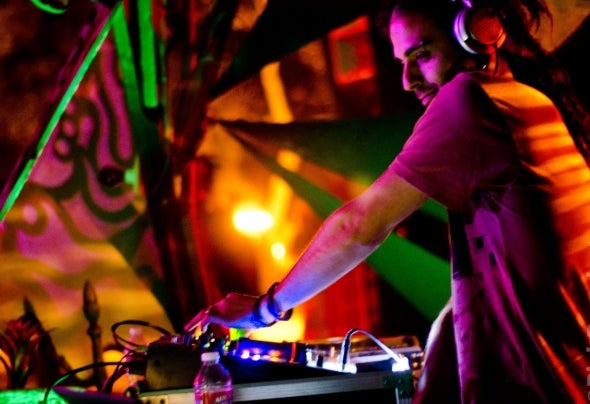
You are a GUI agent. You are given a task and a screenshot of the screen. Output one action in this format:
    pyautogui.click(x=<x>, y=<y>)
    Task: Click on the light
    Image resolution: width=590 pixels, height=404 pixels.
    Given the screenshot: What is the action you would take?
    pyautogui.click(x=252, y=216), pyautogui.click(x=278, y=249)